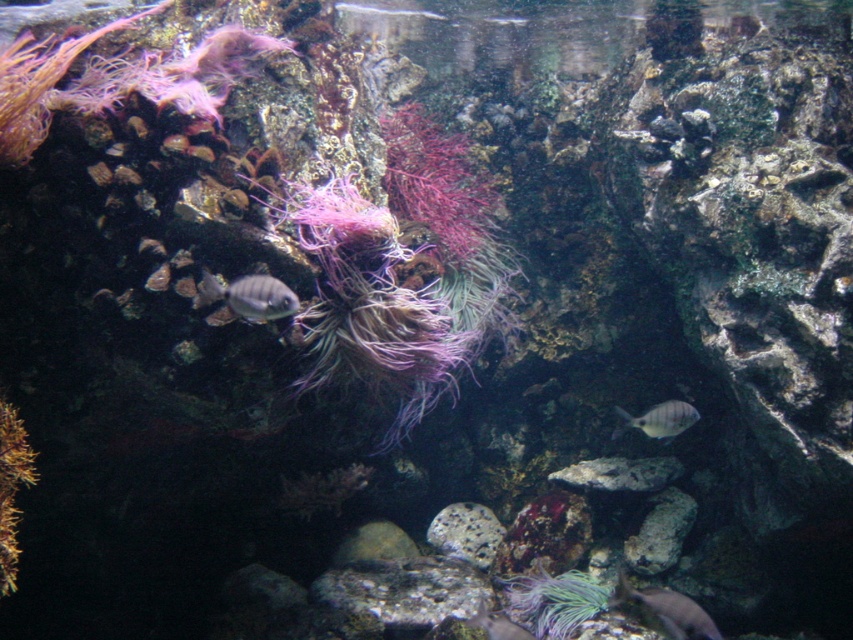
Does smooth gray rock at center appear on the left side of silvery metallic fish at lower center?

No, smooth gray rock at center is not to the left of silvery metallic fish at lower center.

The image size is (853, 640). What are the coordinates of `smooth gray rock at center` in the screenshot? It's located at (660, 532).

Is point (651, 536) positioned in front of point (682, 426)?

No, (651, 536) is behind (682, 426).

The height and width of the screenshot is (640, 853). What do you see at coordinates (660, 532) in the screenshot?
I see `smooth gray rock at center` at bounding box center [660, 532].

This screenshot has height=640, width=853. Identify the location of smooth gray rock at center. (660, 532).

Is point (679, 524) farther from camera compared to point (234, 307)?

Yes, point (679, 524) is behind point (234, 307).

Locate an element on the screen. smooth gray rock at center is located at coordinates (660, 532).

This screenshot has height=640, width=853. Find the location of `smooth gray rock at center`. smooth gray rock at center is located at coordinates (660, 532).